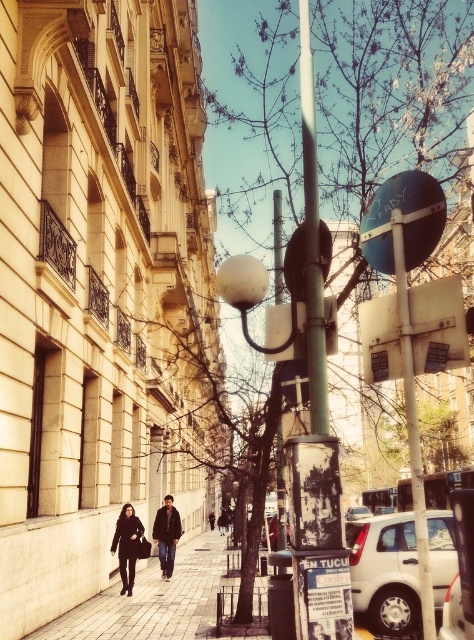
You are a photographer trying to capture both the dark brown leather jacket at lower center and the dark brown leather jacket at center in a single shot. Which jacket should you focus on to ensure both are in frame without moving the camera?

The dark brown leather jacket at lower center is much taller than the dark brown leather jacket at center, so focusing on the taller jacket will help ensure both are within the frame.

You are a photographer standing at the camera position. You want to take a photo of the green matte pole at center. However, there is a requirement that the pole must be at least 30 meters away from the camera to achieve the desired depth of field. Can you achieve this requirement with your current position?

The green matte pole at center is only 27.20 meters from the camera, which is less than the required 30 meters. Therefore, you cannot achieve the desired depth of field with your current position.

You are a delivery person trying to navigate through the street. You see the green matte pole at center and the metallic pole at center. Which pole is closer to you as you face the street?

The green matte pole at center is closer to you because the metallic pole at center is behind it.